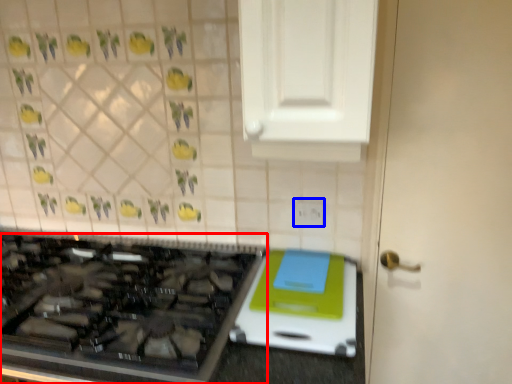
Question: Which of the following is the closest to the observer, gas stove (highlighted by a red box) or electric outlet (highlighted by a blue box)?

Choices:
 (A) gas stove
 (B) electric outlet

Answer: (A)